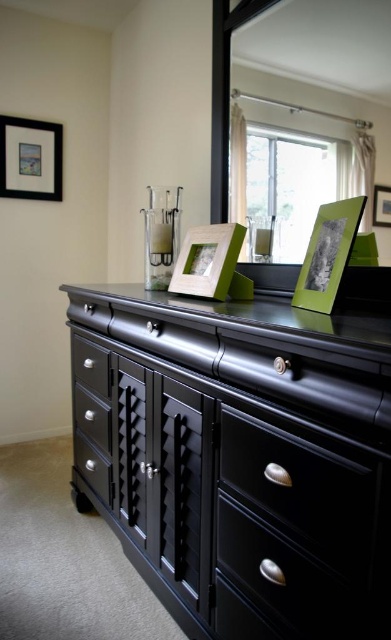
You are an interior designer arranging items on a black wooden dresser. You have a green matte picture frame at right and a matte white picture frame at center. If you want to place a new decorative item between them, how much space do you need to leave between the two existing frames?

The green matte picture frame at right is 13.27 inches away from the matte white picture frame at center, so you need to leave at least 13.27 inches between them to accommodate the new item.

You are standing in the room and want to place a small plant between the two points, point (328,221) and point (186,272). Which point should the plant be closer to in order to be nearer to the viewer?

The plant should be closer to point (328,221) because it is nearer to the viewer than point (186,272).